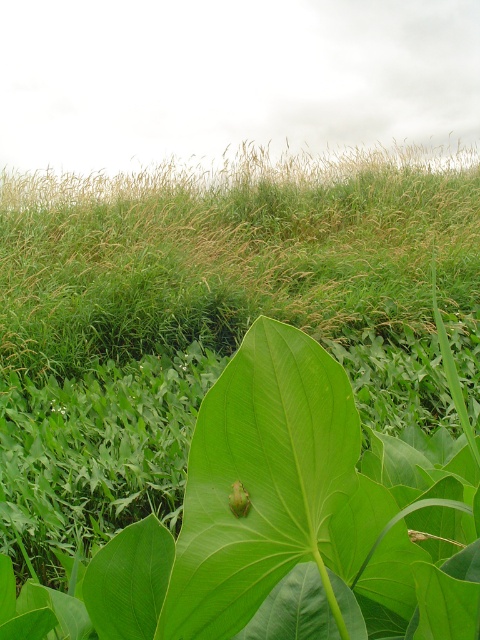
You are a small insect trying to travel from the green grass at center to the green matte leaf at center. Given that your maximum jump distance is 4 meters, can you safely make the jump in one attempt?

The distance between the green grass at center and the green matte leaf at center is 4.78 meters, which exceeds your maximum jump distance of 4 meters. Therefore, you cannot safely make the jump in one attempt.

From the picture: You are a photographer positioned at the camera. You want to capture a closeup of the frog on the large green leaf while ensuring the dense vegetation in the midground is still visible in the background. Which point, point (82, 368) or point (314, 556), should you focus on to achieve this?

You should focus on point (82, 368) because it is closer to the camera than point (314, 556). This will keep the frog on the leaf in focus while allowing the midground vegetation to remain visible in the background.

You are a small insect trying to reach the green matte leaf at center from the green grass at center. Which direction should you move to get to the leaf?

The green grass at center has a lesser height compared to the green matte leaf at center, so you should move upward to reach the green matte leaf at center from the green grass at center.